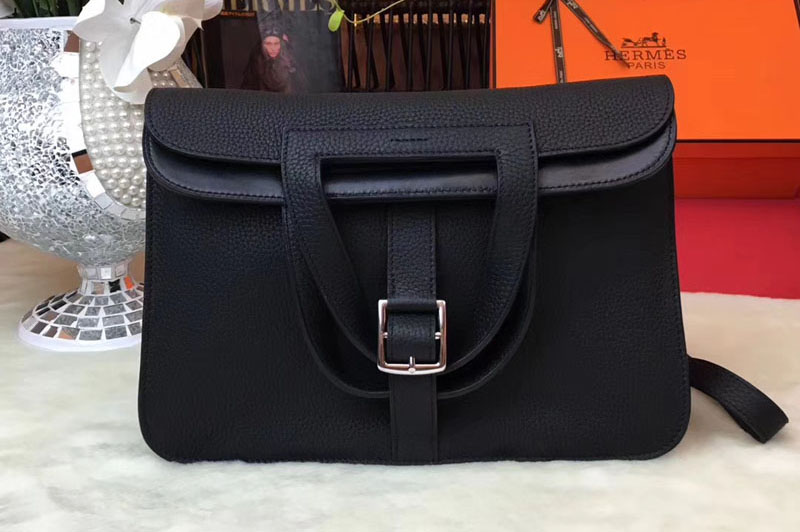
Identify the location of marble countertop. (96, 482).